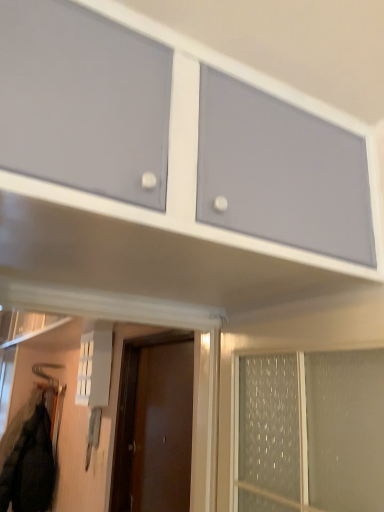
Question: Is matte gray cabinet at upper center located outside black matte jacket at lower left?

Choices:
 (A) no
 (B) yes

Answer: (B)

Question: From the image's perspective, is matte gray cabinet at upper center on top of black matte jacket at lower left?

Choices:
 (A) yes
 (B) no

Answer: (A)

Question: Considering the relative sizes of matte gray cabinet at upper center and black matte jacket at lower left in the image provided, is matte gray cabinet at upper center smaller than black matte jacket at lower left?

Choices:
 (A) no
 (B) yes

Answer: (A)

Question: Is the depth of matte gray cabinet at upper center greater than that of black matte jacket at lower left?

Choices:
 (A) no
 (B) yes

Answer: (A)

Question: Could black matte jacket at lower left be considered to be inside matte gray cabinet at upper center?

Choices:
 (A) yes
 (B) no

Answer: (B)

Question: Considering the positions of black matte jacket at lower left and brown matte door at center in the image, is black matte jacket at lower left taller or shorter than brown matte door at center?

Choices:
 (A) short
 (B) tall

Answer: (A)

Question: Is point (43, 477) closer or farther from the camera than point (125, 347)?

Choices:
 (A) closer
 (B) farther

Answer: (B)

Question: From the image's perspective, is black matte jacket at lower left positioned above or below brown matte door at center?

Choices:
 (A) above
 (B) below

Answer: (B)

Question: Looking at their shapes, would you say black matte jacket at lower left is wider or thinner than brown matte door at center?

Choices:
 (A) thin
 (B) wide

Answer: (B)

Question: Is brown matte door at center wider or thinner than matte gray cabinet at upper center?

Choices:
 (A) thin
 (B) wide

Answer: (A)

Question: Is brown matte door at center in front of or behind matte gray cabinet at upper center in the image?

Choices:
 (A) behind
 (B) front

Answer: (A)

Question: Considering the positions of brown matte door at center and matte gray cabinet at upper center in the image, is brown matte door at center taller or shorter than matte gray cabinet at upper center?

Choices:
 (A) short
 (B) tall

Answer: (B)

Question: From a real-world perspective, is brown matte door at center physically located above or below matte gray cabinet at upper center?

Choices:
 (A) below
 (B) above

Answer: (A)

Question: Is brown matte door at center inside or outside of black matte jacket at lower left?

Choices:
 (A) inside
 (B) outside

Answer: (B)

Question: In terms of size, does brown matte door at center appear bigger or smaller than black matte jacket at lower left?

Choices:
 (A) small
 (B) big

Answer: (A)